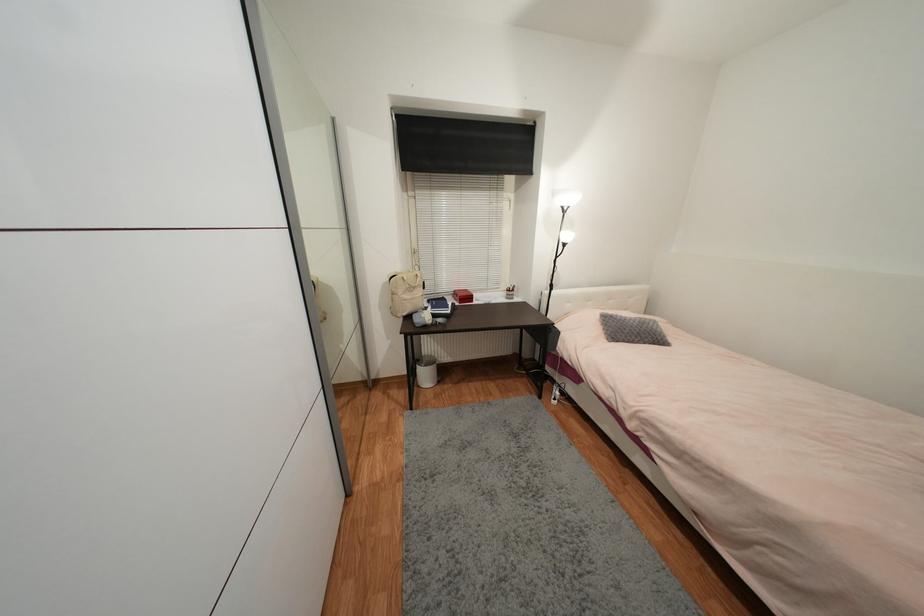
The image size is (924, 616). What are the coordinates of `beige backpack handle` in the screenshot? It's located at (416, 280).